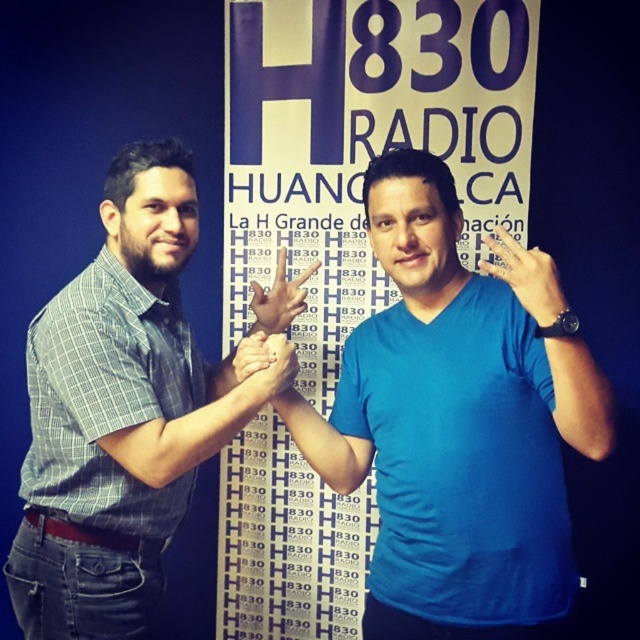
Based on the photo, you are standing in front of a blue fabric poster at center that is part of a studio setup with two people. If you want to reach the top edge of the poster without moving your feet, which part of your body would you most likely use?

The blue fabric poster at center is 7.47 feet away from viewer. Since an average person is about 5.5 to 6.5 feet tall, you would likely need to stretch your arms to reach the top edge of the poster.

You are a photographer adjusting your camera settings to capture the blue fabric poster at center and the matte black hand at center. If your camera has a depth of field that can focus on objects within 30 inches of each other, will both objects be in focus?

The blue fabric poster at center and the matte black hand at center are 31.95 inches apart from each other. Since the distance between them exceeds the 30 inches required for the camera to focus, both objects will not be in focus simultaneously.